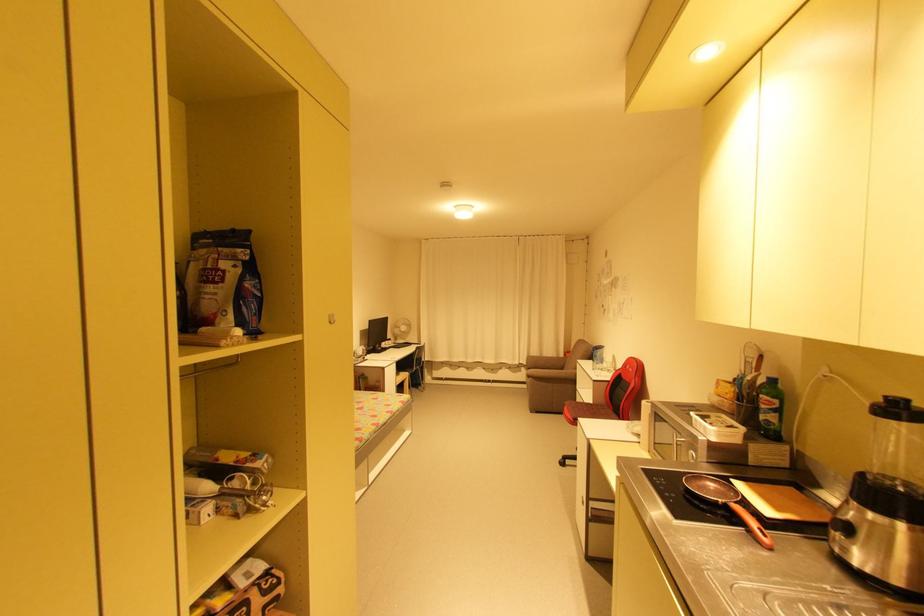
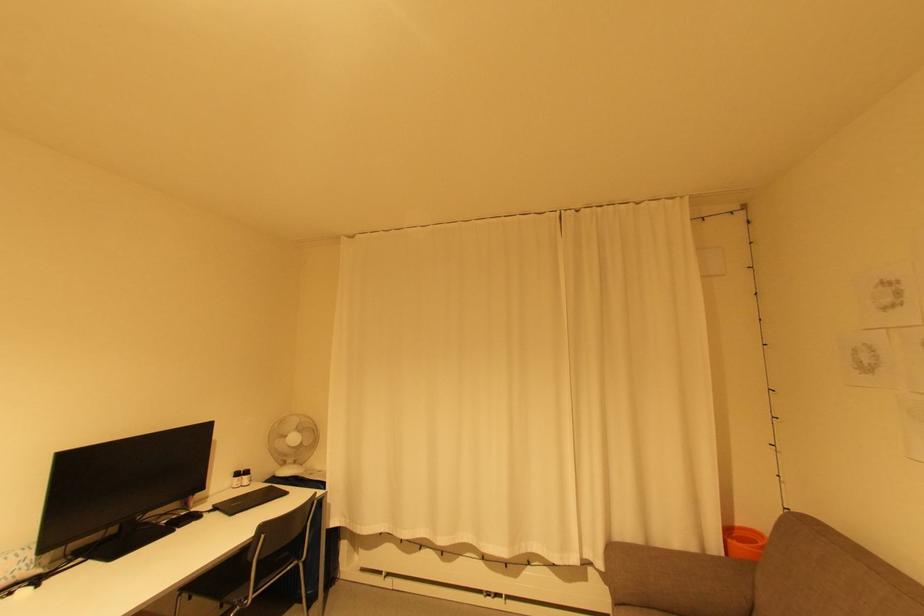
Locate, in the second image, the point that corresponds to pixel 395 342 in the first image.

(250, 477)